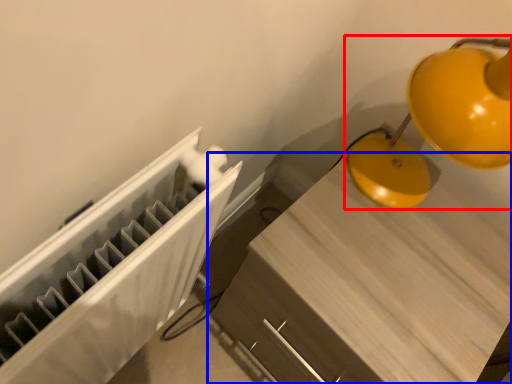
Question: Which point is further to the camera, lamp (highlighted by a red box) or furniture (highlighted by a blue box)?

Choices:
 (A) lamp
 (B) furniture

Answer: (B)